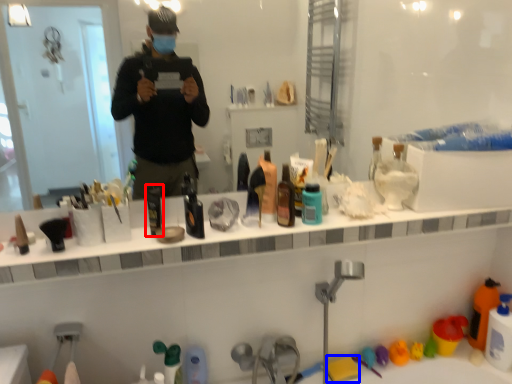
Question: Which object appears farthest to the camera in this image, mouthwash (highlighted by a red box) or toy (highlighted by a blue box)?

Choices:
 (A) mouthwash
 (B) toy

Answer: (B)